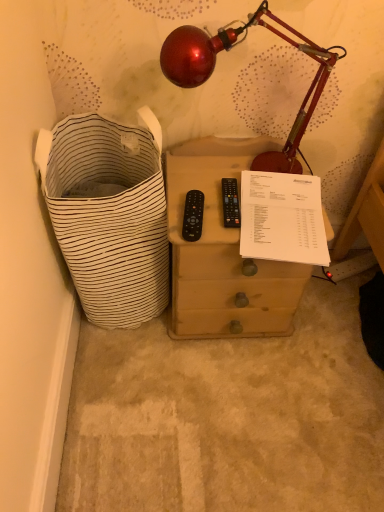
Where is `free space in front of black plastic remote at center, the second control when ordered from left to right`? free space in front of black plastic remote at center, the second control when ordered from left to right is located at coordinates (235, 233).